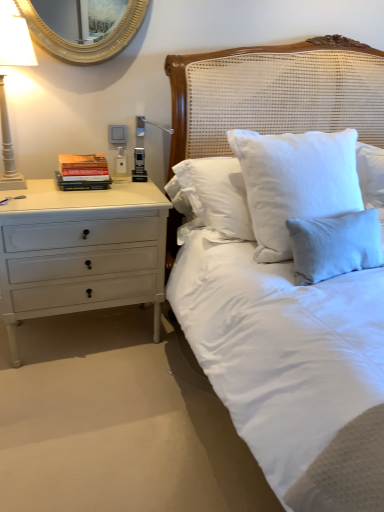
Identify the location of vacant space underneath gold metallic mirror at upper left (from a real-world perspective). (117, 172).